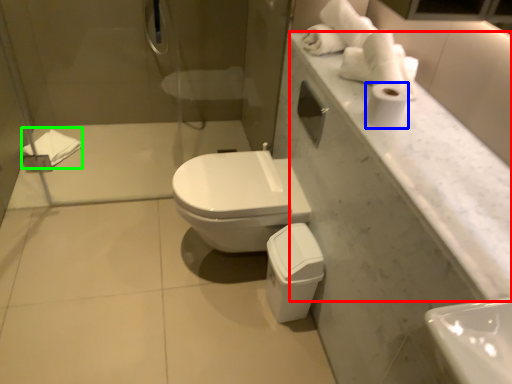
Question: Which object is the closest to the counter top (highlighted by a red box)? Choose among these: toilet paper (highlighted by a blue box) or bath towel (highlighted by a green box).

Choices:
 (A) toilet paper
 (B) bath towel

Answer: (A)